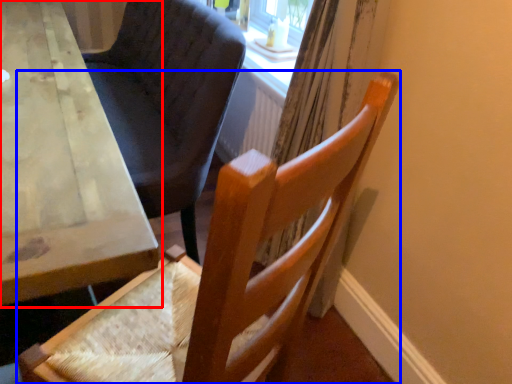
Question: Which object is further to the camera taking this photo, table (highlighted by a red box) or chair (highlighted by a blue box)?

Choices:
 (A) table
 (B) chair

Answer: (A)